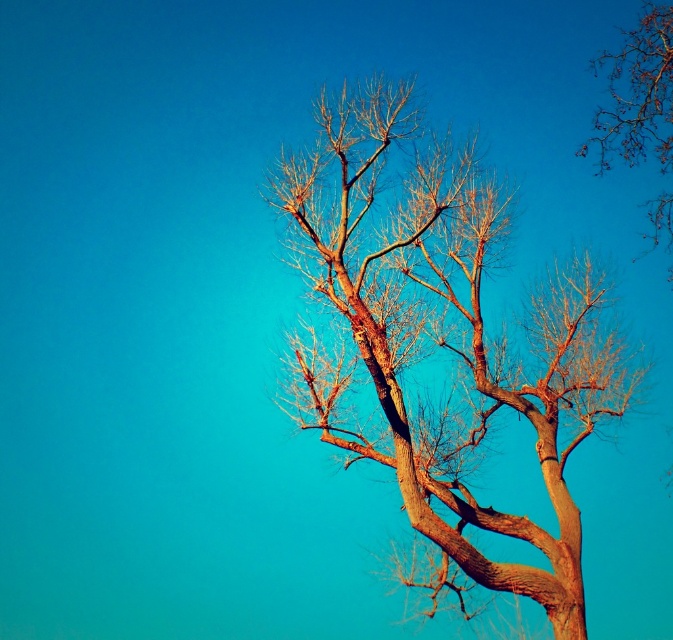
Question: Among these points, which one is nearest to the camera?

Choices:
 (A) (623, 67)
 (B) (378, 106)

Answer: (B)

Question: Is brown textured tree at center further to camera compared to bare branches at upper right?

Choices:
 (A) yes
 (B) no

Answer: (B)

Question: Can you confirm if brown textured tree at center is positioned to the right of bare branches at upper right?

Choices:
 (A) no
 (B) yes

Answer: (A)

Question: Is brown textured tree at center to the left of bare branches at upper right from the viewer's perspective?

Choices:
 (A) no
 (B) yes

Answer: (B)

Question: Among these objects, which one is nearest to the camera?

Choices:
 (A) bare branches at upper right
 (B) brown textured tree at center

Answer: (B)